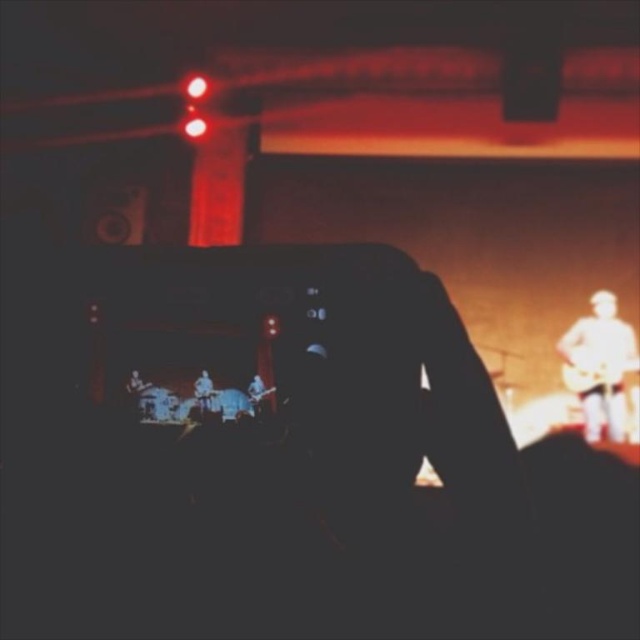
Can you confirm if light brown wooden guitar at right is taller than light blue fabric at center?

Yes, light brown wooden guitar at right is taller than light blue fabric at center.

Which is in front, point (600, 413) or point (211, 404)?

Point (211, 404)

Who is more distant from viewer, (596, 305) or (195, 397)?

Positioned behind is point (596, 305).

This screenshot has width=640, height=640. Find the location of `light brown wooden guitar at right`. light brown wooden guitar at right is located at coordinates (600, 365).

Describe the element at coordinates (600, 365) in the screenshot. I see `light brown wooden guitar at right` at that location.

Is light brown wooden guitar at right smaller than wooden acoustic guitar at right?

Actually, light brown wooden guitar at right might be larger than wooden acoustic guitar at right.

The image size is (640, 640). What do you see at coordinates (600, 365) in the screenshot? I see `light brown wooden guitar at right` at bounding box center [600, 365].

Where is `light brown wooden guitar at right`? Image resolution: width=640 pixels, height=640 pixels. light brown wooden guitar at right is located at coordinates (600, 365).

This screenshot has width=640, height=640. What are the coordinates of `light blue fabric at center` in the screenshot? It's located at (204, 392).

This screenshot has width=640, height=640. I want to click on light blue fabric at center, so click(204, 392).